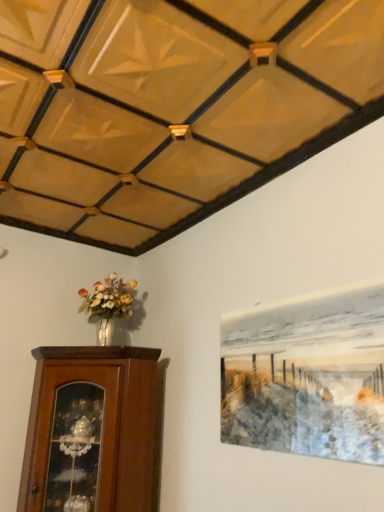
Question: Looking at the image, does brown wooden cabinet at lower left seem bigger or smaller compared to metallic silver painting at upper right?

Choices:
 (A) big
 (B) small

Answer: (A)

Question: In the image, is brown wooden cabinet at lower left positioned in front of or behind metallic silver painting at upper right?

Choices:
 (A) front
 (B) behind

Answer: (B)

Question: In terms of height, does brown wooden cabinet at lower left look taller or shorter compared to metallic silver painting at upper right?

Choices:
 (A) tall
 (B) short

Answer: (A)

Question: Considering the positions of metallic silver painting at upper right and brown wooden cabinet at lower left in the image, is metallic silver painting at upper right wider or thinner than brown wooden cabinet at lower left?

Choices:
 (A) wide
 (B) thin

Answer: (B)

Question: Considering the relative positions of metallic silver painting at upper right and brown wooden cabinet at lower left in the image provided, is metallic silver painting at upper right to the left or to the right of brown wooden cabinet at lower left?

Choices:
 (A) left
 (B) right

Answer: (B)

Question: From a real-world perspective, is metallic silver painting at upper right above or below brown wooden cabinet at lower left?

Choices:
 (A) above
 (B) below

Answer: (A)

Question: From the image's perspective, is metallic silver painting at upper right above or below brown wooden cabinet at lower left?

Choices:
 (A) below
 (B) above

Answer: (B)